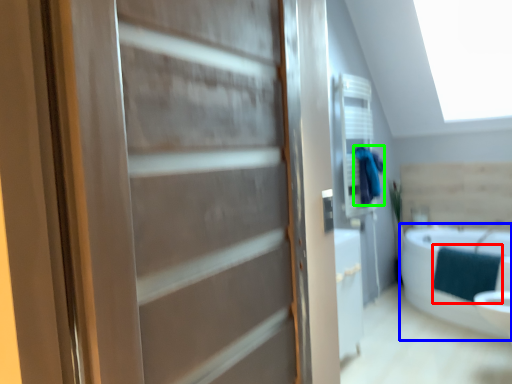
Question: Which is nearer to the blanket (highlighted by a red box)? bathtub (highlighted by a blue box) or bathrobe (highlighted by a green box).

Choices:
 (A) bathtub
 (B) bathrobe

Answer: (A)